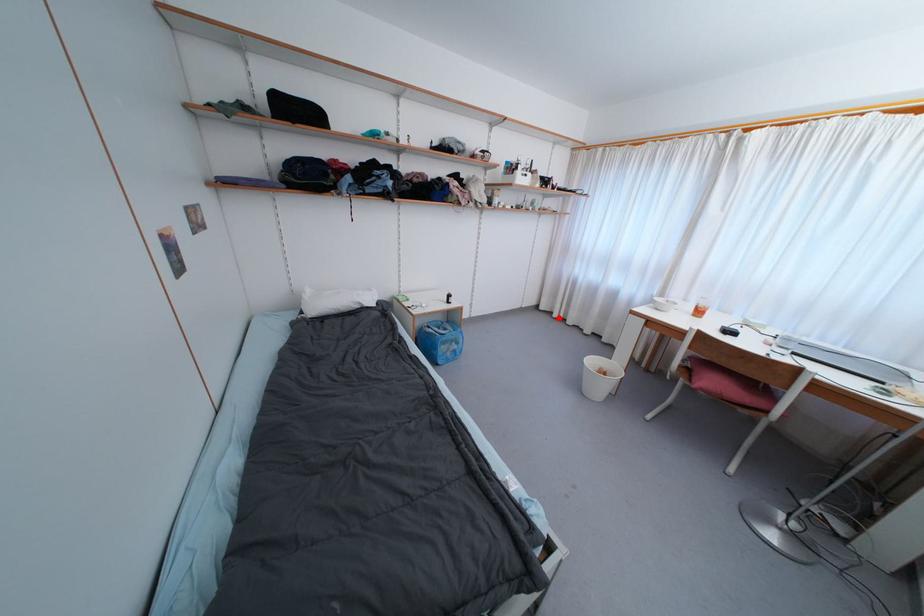
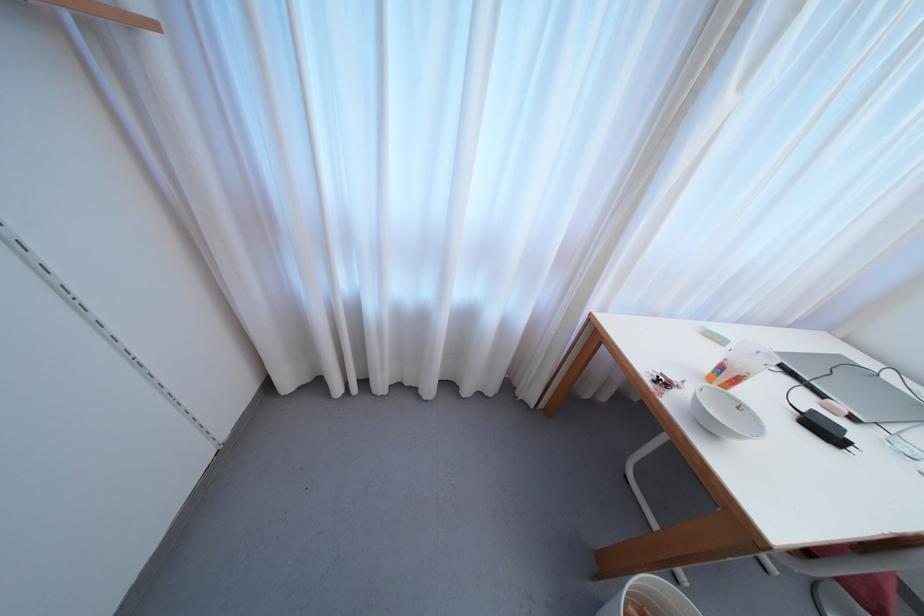
Where in the second image is the point corresponding to the highlighted location from the first image?

(342, 392)